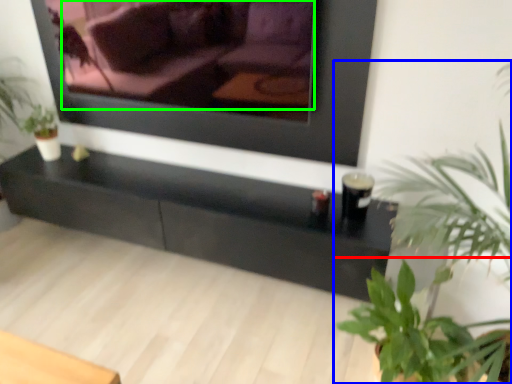
Question: Which object is the farthest from houseplant (highlighted by a red box)? Choose among these: houseplant (highlighted by a blue box) or couch (highlighted by a green box).

Choices:
 (A) houseplant
 (B) couch

Answer: (B)